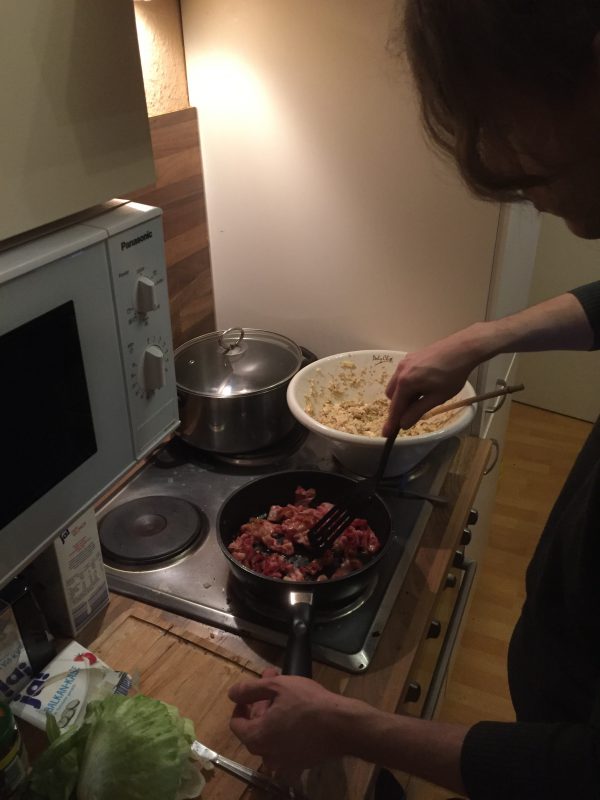
Find the location of a particular element. Image resolution: width=600 pixels, height=800 pixels. black knobs/buttons is located at coordinates (437, 630), (415, 690), (451, 574), (458, 562), (464, 538), (475, 520).